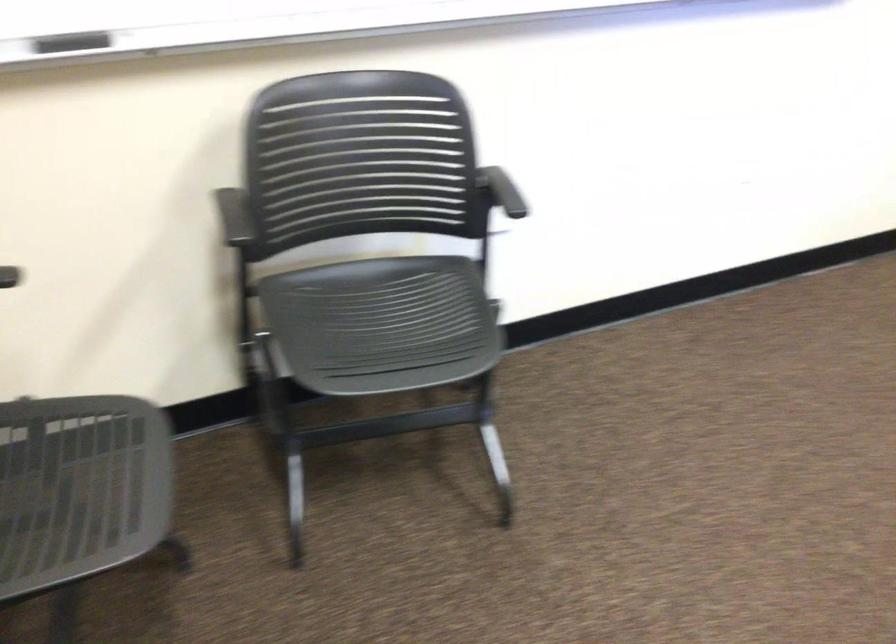
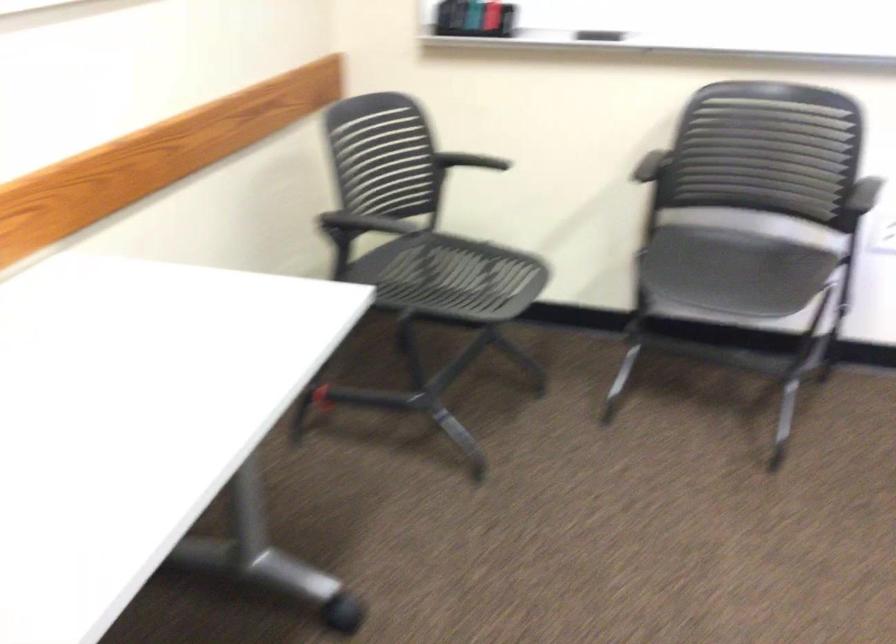
In the second image, find the point that corresponds to the point at 236,218 in the first image.

(649, 166)